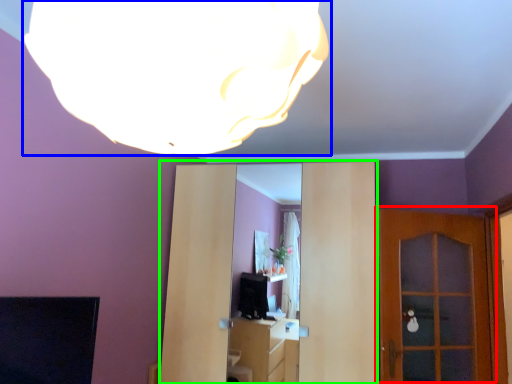
Question: Which is farther away from door (highlighted by a red box)? lamp (highlighted by a blue box) or entertainment center (highlighted by a green box)?

Choices:
 (A) lamp
 (B) entertainment center

Answer: (A)